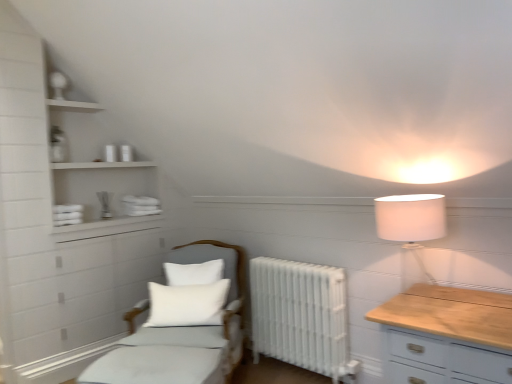
Question: Considering the relative sizes of white matte shelves at upper left and white fabric lampshade at upper right in the image provided, is white matte shelves at upper left taller than white fabric lampshade at upper right?

Choices:
 (A) no
 (B) yes

Answer: (B)

Question: Considering the relative sizes of white matte shelves at upper left and white fabric lampshade at upper right in the image provided, is white matte shelves at upper left wider than white fabric lampshade at upper right?

Choices:
 (A) yes
 (B) no

Answer: (A)

Question: Considering the relative sizes of white matte shelves at upper left and white fabric lampshade at upper right in the image provided, is white matte shelves at upper left thinner than white fabric lampshade at upper right?

Choices:
 (A) no
 (B) yes

Answer: (A)

Question: Is white matte shelves at upper left at the left side of white fabric lampshade at upper right?

Choices:
 (A) no
 (B) yes

Answer: (B)

Question: From a real-world perspective, is white matte shelves at upper left below white fabric lampshade at upper right?

Choices:
 (A) no
 (B) yes

Answer: (A)

Question: Can you confirm if white matte shelves at upper left is bigger than white fabric lampshade at upper right?

Choices:
 (A) yes
 (B) no

Answer: (A)

Question: Does white soft cushion at center have a larger size compared to light gray fabric chair at center?

Choices:
 (A) yes
 (B) no

Answer: (B)

Question: Is light gray fabric chair at center completely or partially inside white soft cushion at center?

Choices:
 (A) yes
 (B) no

Answer: (B)

Question: Could you tell me if white soft cushion at center is turned towards light gray fabric chair at center?

Choices:
 (A) no
 (B) yes

Answer: (B)

Question: Does white soft cushion at center appear on the right side of light gray fabric chair at center?

Choices:
 (A) no
 (B) yes

Answer: (A)

Question: Does white soft cushion at center have a greater width compared to light gray fabric chair at center?

Choices:
 (A) yes
 (B) no

Answer: (B)

Question: Is white soft cushion at center at the left side of light gray fabric chair at center?

Choices:
 (A) no
 (B) yes

Answer: (B)

Question: From a real-world perspective, is white soft cushion at center located beneath white matte shelves at upper left?

Choices:
 (A) no
 (B) yes

Answer: (B)